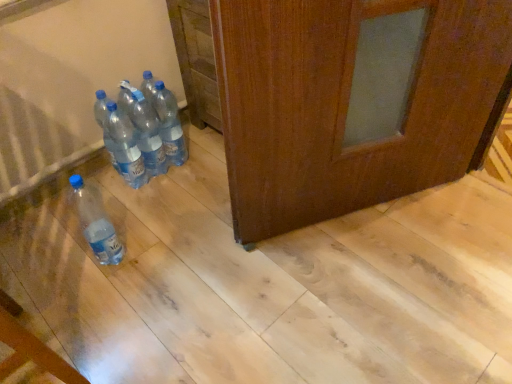
Question: Is matte plastic bottle at lower left, marked as the 1th bottle in a left-to-right arrangement, spatially inside clear plastic bottles at center, which is the 3th bottle in right-to-left order, or outside of it?

Choices:
 (A) inside
 (B) outside

Answer: (B)

Question: From the image's perspective, is matte plastic bottle at lower left, marked as the 1th bottle in a left-to-right arrangement, located above or below clear plastic bottles at center, the second bottle from the left?

Choices:
 (A) below
 (B) above

Answer: (A)

Question: Estimate the real-world distances between objects in this image. Which object is closer to the transparent plastic bottles at center, the first bottle viewed from the right?

Choices:
 (A) clear plastic bottles at center, which is the 3th bottle in right-to-left order
 (B) matte plastic bottle at lower left, which appears as the fourth bottle when viewed from the right
 (C) transparent plastic bottles at center, which ranks as the 3th bottle in left-to-right order

Answer: (C)

Question: Estimate the real-world distances between objects in this image. Which object is closer to the transparent plastic bottles at center, arranged as the 2th bottle when viewed from the right?

Choices:
 (A) matte plastic bottle at lower left, which appears as the fourth bottle when viewed from the right
 (B) transparent plastic bottles at center, acting as the 4th bottle starting from the left
 (C) clear plastic bottles at center, which is the 3th bottle in right-to-left order

Answer: (C)